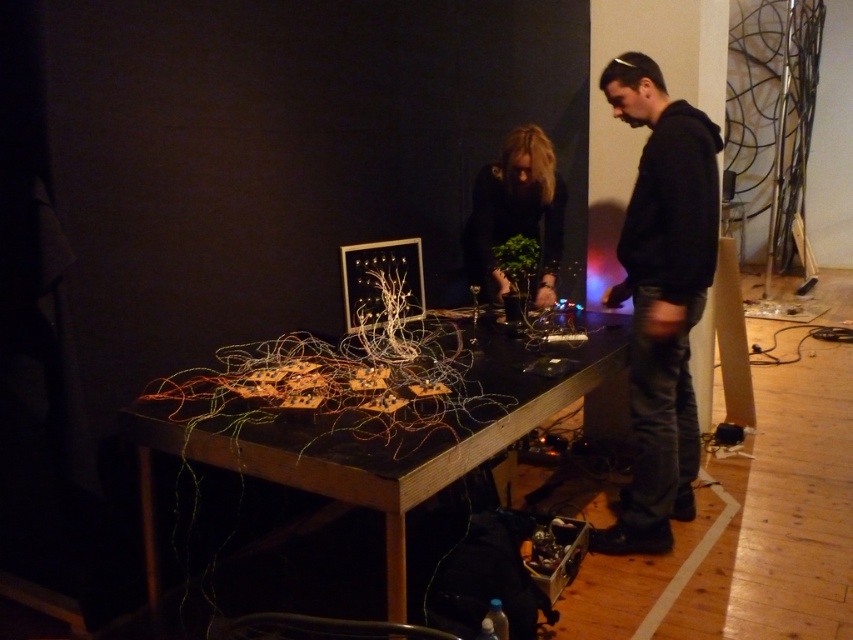
Question: Which of these objects is positioned closest to the wooden table at center?

Choices:
 (A) black matte plant at center
 (B) black hoodie at right

Answer: (B)

Question: Which of the following is the farthest from the observer?

Choices:
 (A) black matte plant at center
 (B) wooden table at center

Answer: (A)

Question: Which point appears farthest from the camera in this image?

Choices:
 (A) (523, 419)
 (B) (473, 195)

Answer: (B)

Question: Is wooden table at center behind black hoodie at right?

Choices:
 (A) yes
 (B) no

Answer: (B)

Question: Does wooden table at center lie behind black hoodie at right?

Choices:
 (A) yes
 (B) no

Answer: (B)

Question: Does wooden table at center appear on the right side of black matte plant at center?

Choices:
 (A) no
 (B) yes

Answer: (A)